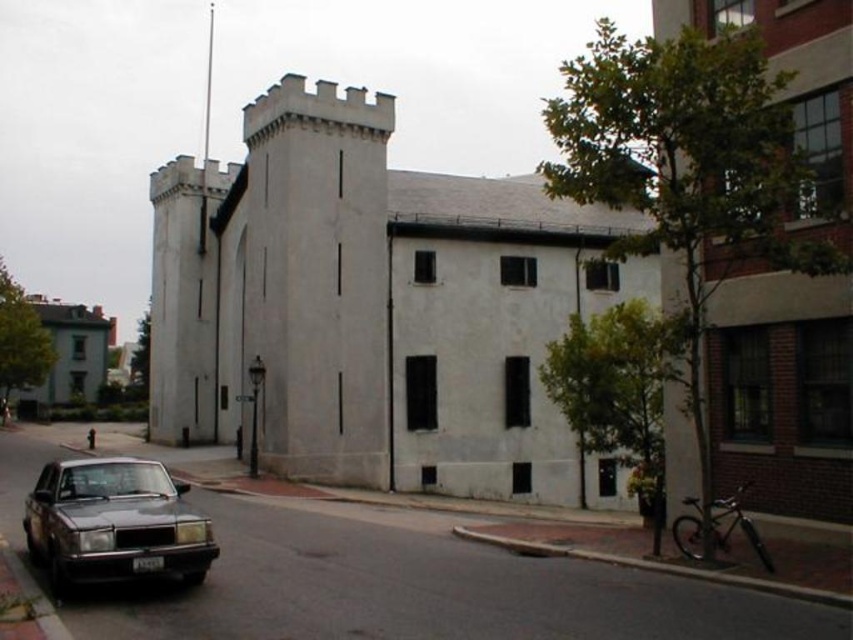
Question: Which object is farther from the camera taking this photo?

Choices:
 (A) white smooth stone castle at center
 (B) shiny dark gray sedan at lower left

Answer: (A)

Question: Which point is closer to the camera?

Choices:
 (A) white smooth stone castle at center
 (B) shiny dark gray sedan at lower left

Answer: (B)

Question: Is white smooth stone castle at center smaller than shiny dark gray sedan at lower left?

Choices:
 (A) yes
 (B) no

Answer: (B)

Question: From the image, what is the correct spatial relationship of white smooth stone castle at center in relation to shiny dark gray sedan at lower left?

Choices:
 (A) above
 (B) below

Answer: (A)

Question: Observing the image, what is the correct spatial positioning of white smooth stone castle at center in reference to shiny dark gray sedan at lower left?

Choices:
 (A) below
 (B) above

Answer: (B)

Question: Which point is closer to the camera?

Choices:
 (A) white smooth stone castle at center
 (B) shiny dark gray sedan at lower left

Answer: (B)